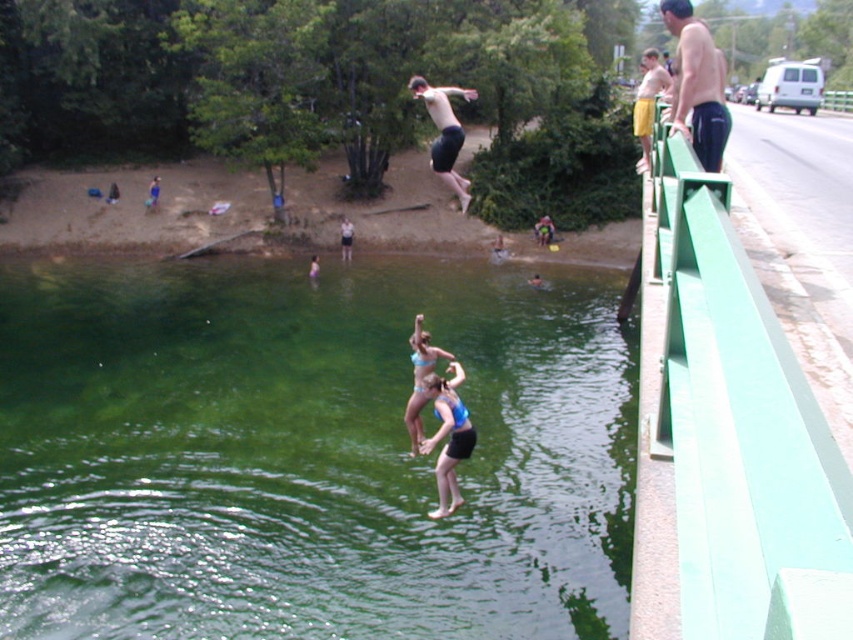
Does green translucent water at center have a lesser height compared to skinny jeans at right?

No.

Can you confirm if green translucent water at center is thinner than skinny jeans at right?

No, green translucent water at center is not thinner than skinny jeans at right.

Is point (314, 493) more distant than point (691, 136)?

Yes, point (314, 493) is behind point (691, 136).

Where is `green translucent water at center`? Image resolution: width=853 pixels, height=640 pixels. green translucent water at center is located at coordinates (x=306, y=452).

Is green translucent water at center smaller than blue fabric shorts at center?

No.

Is green translucent water at center below blue fabric shorts at center?

Incorrect, green translucent water at center is not positioned below blue fabric shorts at center.

Identify the location of green translucent water at center. The image size is (853, 640). (306, 452).

Is skinny jeans at right further to camera compared to blue fabric shorts at center?

No, it is in front of blue fabric shorts at center.

Between skinny jeans at right and blue fabric shorts at center, which one is positioned higher?

skinny jeans at right is higher up.

Who is more distant from viewer, (711,42) or (438,432)?

Positioned behind is point (438,432).

Where is `skinny jeans at right`? skinny jeans at right is located at coordinates (697, 83).